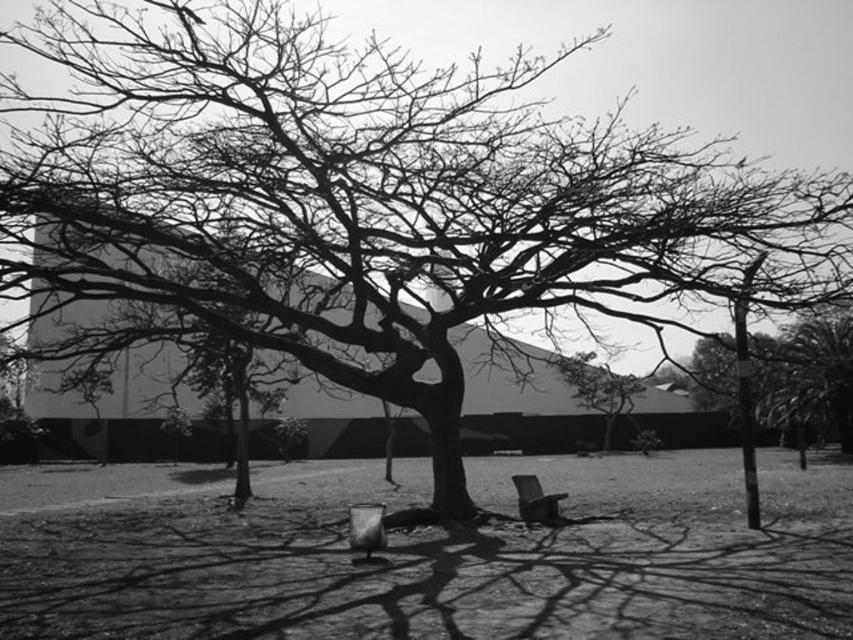
Question: Estimate the real-world distances between objects in this image. Which object is farther from the smooth black chair at center?

Choices:
 (A) metallic silver chair at center
 (B) smooth bark tree at center

Answer: (B)

Question: Does smooth bark tree at center come in front of smooth black chair at center?

Choices:
 (A) yes
 (B) no

Answer: (B)

Question: Is smooth bark tree at center further to camera compared to metallic silver chair at center?

Choices:
 (A) no
 (B) yes

Answer: (B)

Question: Which point is closer to the camera?

Choices:
 (A) (612, 420)
 (B) (546, 522)

Answer: (B)

Question: Is metallic silver chair at center positioned before smooth black chair at center?

Choices:
 (A) no
 (B) yes

Answer: (B)

Question: Among these objects, which one is nearest to the camera?

Choices:
 (A) smooth bark tree at center
 (B) smooth black chair at center
 (C) metallic silver chair at center

Answer: (C)